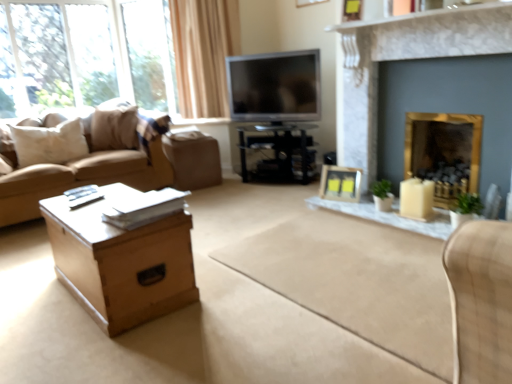
Question: Is black glossy tv stand at center, acting as the 2th table starting from the left, in contact with wooden picture frame at upper center, which is counted as the second picture frame, starting from the bottom?

Choices:
 (A) no
 (B) yes

Answer: (A)

Question: Could wooden picture frame at upper center, arranged as the 1th picture frame when viewed from the top, be considered to be inside black glossy tv stand at center, acting as the 2th table starting from the left?

Choices:
 (A) yes
 (B) no

Answer: (B)

Question: Is black glossy tv stand at center, the 2th table in the bottom-to-top sequence, aimed at wooden picture frame at upper center, the 2th picture frame when ordered from back to front?

Choices:
 (A) yes
 (B) no

Answer: (B)

Question: From a real-world perspective, is black glossy tv stand at center, the 1th table in the back-to-front sequence, physically below wooden picture frame at upper center, which is counted as the second picture frame, starting from the bottom?

Choices:
 (A) no
 (B) yes

Answer: (B)

Question: From a real-world perspective, is black glossy tv stand at center, the 1th table in the back-to-front sequence, positioned over wooden picture frame at upper center, which is counted as the second picture frame, starting from the bottom, based on gravity?

Choices:
 (A) yes
 (B) no

Answer: (B)

Question: From the image's perspective, is beige fabric couch at left located above or below gold metallic fireplace at right, which is the 1th fireplace in back-to-front order?

Choices:
 (A) above
 (B) below

Answer: (A)

Question: In terms of width, does beige fabric couch at left look wider or thinner when compared to gold metallic fireplace at right, the second fireplace in the front-to-back sequence?

Choices:
 (A) thin
 (B) wide

Answer: (B)

Question: In the image, is beige fabric couch at left on the left side or the right side of gold metallic fireplace at right, which is the 1th fireplace in back-to-front order?

Choices:
 (A) left
 (B) right

Answer: (A)

Question: From a real-world perspective, is beige fabric couch at left above or below gold metallic fireplace at right, the second fireplace in the front-to-back sequence?

Choices:
 (A) above
 (B) below

Answer: (A)

Question: Is white marble fireplace at upper center in front of or behind white soft pillow at left in the image?

Choices:
 (A) behind
 (B) front

Answer: (B)

Question: Considering the positions of white marble fireplace at upper center and white soft pillow at left in the image, is white marble fireplace at upper center wider or thinner than white soft pillow at left?

Choices:
 (A) thin
 (B) wide

Answer: (B)

Question: In the image, is white marble fireplace at upper center on the left side or the right side of white soft pillow at left?

Choices:
 (A) left
 (B) right

Answer: (B)

Question: Would you say white marble fireplace at upper center is inside or outside white soft pillow at left?

Choices:
 (A) outside
 (B) inside

Answer: (A)

Question: From the image's perspective, relative to white matte candle holder at right, is white marble fireplace at upper center above or below?

Choices:
 (A) above
 (B) below

Answer: (A)

Question: Considering their positions, is white marble fireplace at upper center located in front of or behind white matte candle holder at right?

Choices:
 (A) front
 (B) behind

Answer: (A)